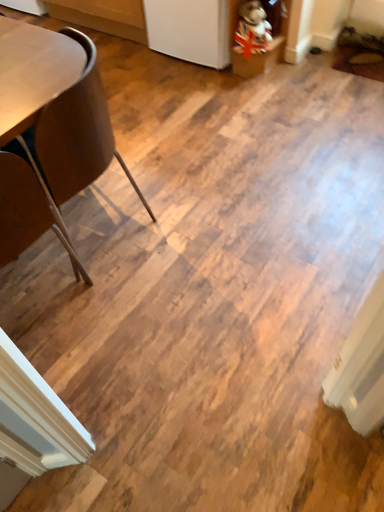
I want to click on vacant space to the right of brown leather chair at left, positioned as the 2th chair in bottom-to-top order, so click(191, 221).